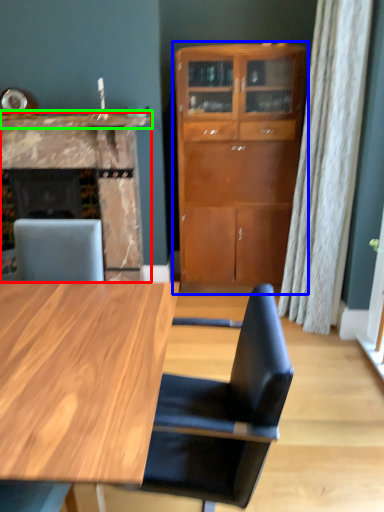
Question: Which object is the closest to the fireplace (highlighted by a red box)? Choose among these: cabinetry (highlighted by a blue box) or counter top (highlighted by a green box).

Choices:
 (A) cabinetry
 (B) counter top

Answer: (B)